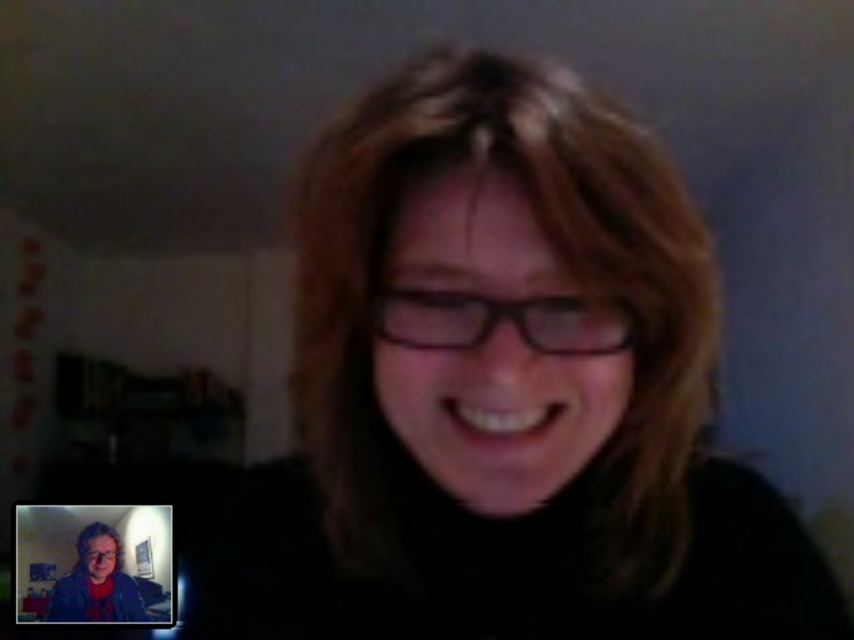
Does matte black glasses at center appear under matte black hair at center?

Actually, matte black glasses at center is above matte black hair at center.

The image size is (854, 640). I want to click on matte black glasses at center, so click(502, 388).